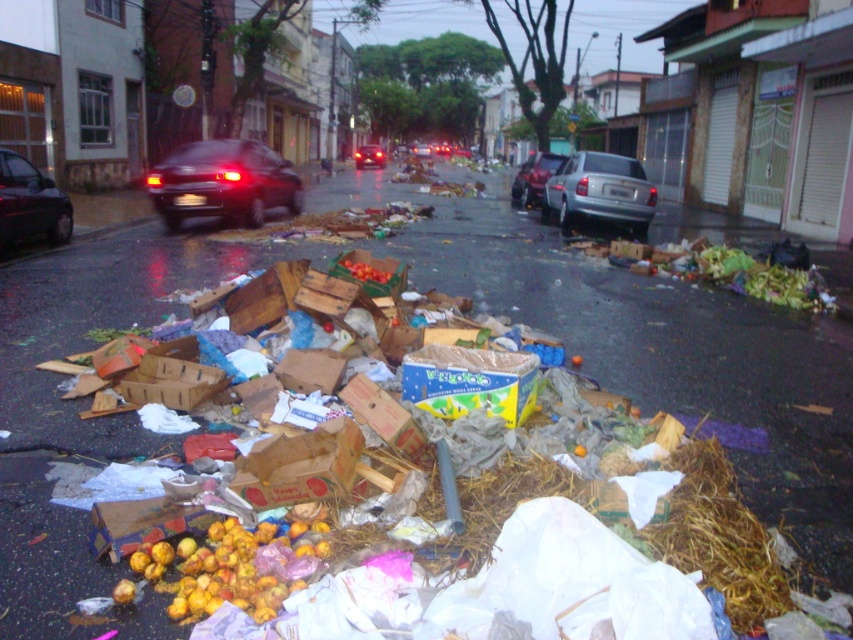
Is shiny black car at left to the right of shiny black sedan at center from the viewer's perspective?

In fact, shiny black car at left is to the left of shiny black sedan at center.

Who is higher up, shiny black car at left or shiny black sedan at center?

shiny black sedan at center is higher up.

You are a GUI agent. You are given a task and a screenshot of the screen. Output one action in this format:
    pyautogui.click(x=<x>, y=<y>)
    Task: Click on the shiny black car at left
    This screenshot has width=853, height=640.
    Given the screenshot: What is the action you would take?
    pyautogui.click(x=30, y=204)

The height and width of the screenshot is (640, 853). Describe the element at coordinates (300, 465) in the screenshot. I see `brown cardboard box at center` at that location.

The height and width of the screenshot is (640, 853). Find the location of `brown cardboard box at center`. brown cardboard box at center is located at coordinates (300, 465).

Between point (341, 474) and point (515, 173), which one is positioned behind?

The point (515, 173) is more distant.

The width and height of the screenshot is (853, 640). Find the location of `brown cardboard box at center`. brown cardboard box at center is located at coordinates (300, 465).

Can you confirm if brown cardboard box at center is wider than shiny black car at left?

Incorrect, brown cardboard box at center's width does not surpass shiny black car at left's.

Which is behind, point (276, 449) or point (32, 196)?

Positioned behind is point (32, 196).

Locate an element on the screen. brown cardboard box at center is located at coordinates (300, 465).